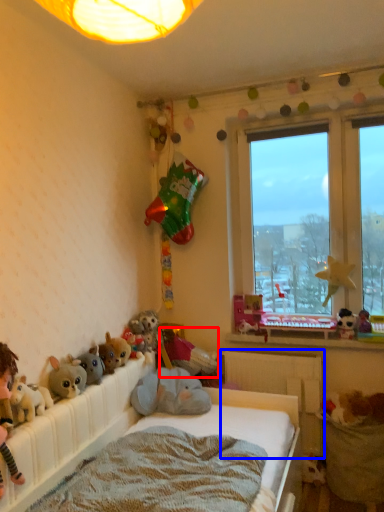
Question: Which object is closer to the camera taking this photo, toy (highlighted by a red box) or radiator (highlighted by a blue box)?

Choices:
 (A) toy
 (B) radiator

Answer: (B)